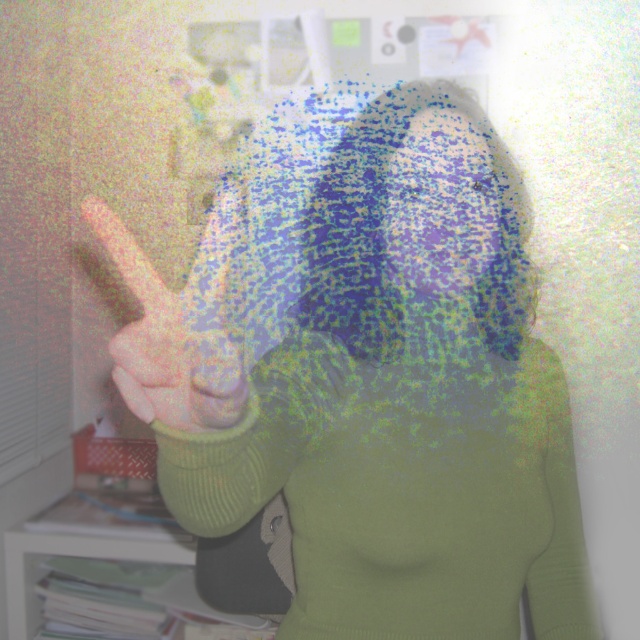
Question: Can you confirm if green ribbed sweater at center is wider than smooth skin hand at center?

Choices:
 (A) no
 (B) yes

Answer: (B)

Question: Is green ribbed sweater at center to the left of smooth skin hand at center from the viewer's perspective?

Choices:
 (A) yes
 (B) no

Answer: (B)

Question: Estimate the real-world distances between objects in this image. Which object is farther from the green ribbed sweater at center?

Choices:
 (A) smooth blue fabric at center
 (B) smooth skin hand at center

Answer: (B)

Question: Estimate the real-world distances between objects in this image. Which object is closer to the green ribbed sweater at center?

Choices:
 (A) smooth blue fabric at center
 (B) smooth skin hand at center

Answer: (A)

Question: Among these objects, which one is farthest from the camera?

Choices:
 (A) smooth blue fabric at center
 (B) green ribbed sweater at center

Answer: (A)

Question: Observing the image, what is the correct spatial positioning of green ribbed sweater at center in reference to smooth skin hand at center?

Choices:
 (A) right
 (B) left

Answer: (A)